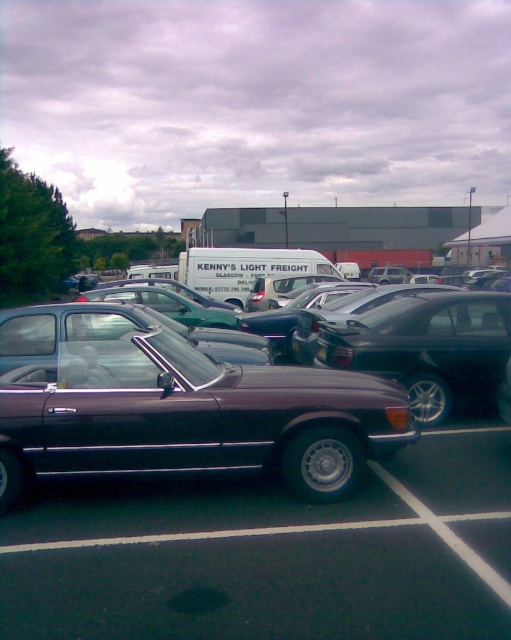
Question: Does shiny maroon convertible at center have a greater width compared to shiny dark brown convertible at center?

Choices:
 (A) yes
 (B) no

Answer: (B)

Question: Can you confirm if shiny maroon convertible at center is positioned to the right of shiny dark brown convertible at center?

Choices:
 (A) yes
 (B) no

Answer: (A)

Question: Which point is closer to the camera?

Choices:
 (A) (170, 349)
 (B) (49, 513)

Answer: (B)

Question: Does shiny maroon convertible at center appear on the left side of shiny dark brown convertible at center?

Choices:
 (A) yes
 (B) no

Answer: (B)